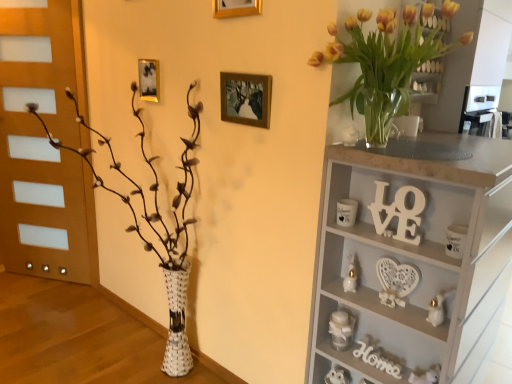
Question: From a real-world perspective, does white wood shelf at upper right stand above gold metallic picture frame at upper center, marked as the second picture frame in a left-to-right arrangement?

Choices:
 (A) no
 (B) yes

Answer: (A)

Question: From a real-world perspective, does white wood shelf at upper right sit lower than gold metallic picture frame at upper center, the 3th picture frame viewed from the back?

Choices:
 (A) yes
 (B) no

Answer: (A)

Question: Is white wood shelf at upper right far from gold metallic picture frame at upper center, marked as the second picture frame in a right-to-left arrangement?

Choices:
 (A) no
 (B) yes

Answer: (B)

Question: Is white wood shelf at upper right placed right next to gold metallic picture frame at upper center, marked as the second picture frame in a left-to-right arrangement?

Choices:
 (A) yes
 (B) no

Answer: (B)

Question: Does white wood shelf at upper right appear on the right side of gold metallic picture frame at upper center, which is counted as the first picture frame, starting from the top?

Choices:
 (A) no
 (B) yes

Answer: (B)

Question: Considering the positions of point (169, 279) and point (434, 357), is point (169, 279) closer or farther from the camera than point (434, 357)?

Choices:
 (A) farther
 (B) closer

Answer: (A)

Question: From the image's perspective, is white woven vase at left positioned above or below white wood shelf at upper right?

Choices:
 (A) below
 (B) above

Answer: (B)

Question: Based on their sizes in the image, would you say white woven vase at left is bigger or smaller than white wood shelf at upper right?

Choices:
 (A) big
 (B) small

Answer: (A)

Question: Would you say white woven vase at left is to the left or to the right of white wood shelf at upper right in the picture?

Choices:
 (A) left
 (B) right

Answer: (A)

Question: From the image's perspective, is wooden picture frame at center, acting as the 3th picture frame starting from the left, positioned above or below white wooden sign at upper right?

Choices:
 (A) above
 (B) below

Answer: (A)

Question: Do you think wooden picture frame at center, which is the second picture frame in back-to-front order, is within white wooden sign at upper right, or outside of it?

Choices:
 (A) outside
 (B) inside

Answer: (A)

Question: Considering the positions of point click(x=252, y=87) and point click(x=411, y=215), is point click(x=252, y=87) closer or farther from the camera than point click(x=411, y=215)?

Choices:
 (A) closer
 (B) farther

Answer: (B)

Question: Considering the positions of wooden picture frame at center, acting as the 3th picture frame starting from the left, and white wooden sign at upper right in the image, is wooden picture frame at center, acting as the 3th picture frame starting from the left, taller or shorter than white wooden sign at upper right?

Choices:
 (A) short
 (B) tall

Answer: (A)

Question: Relative to gold metallic picture frame at upper center, which is the 2th picture frame from top to bottom, is white woven vase at left in front or behind?

Choices:
 (A) behind
 (B) front

Answer: (B)

Question: Based on their positions, is white woven vase at left located to the left or right of gold metallic picture frame at upper center, which is the 1th picture frame from back to front?

Choices:
 (A) right
 (B) left

Answer: (B)